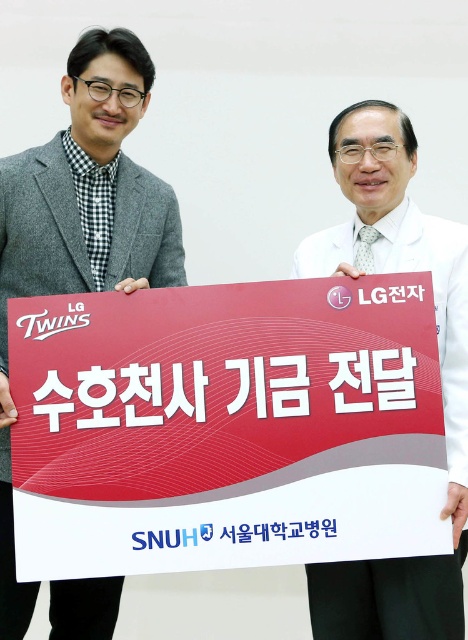
Who is higher up, matte gray blazer at left or white lab coat at center?

Positioned higher is matte gray blazer at left.

Who is more distant from viewer, (x=81, y=134) or (x=446, y=618)?

Point (x=81, y=134)

Where is `matte gray blazer at left`? The width and height of the screenshot is (468, 640). matte gray blazer at left is located at coordinates (80, 230).

Is red paper sign at center below matte gray blazer at left?

Yes, red paper sign at center is below matte gray blazer at left.

Can you confirm if red paper sign at center is smaller than matte gray blazer at left?

Correct, red paper sign at center occupies less space than matte gray blazer at left.

Locate an element on the screen. The height and width of the screenshot is (640, 468). red paper sign at center is located at coordinates (226, 428).

Where is `red paper sign at center`? red paper sign at center is located at coordinates (226, 428).

Which is above, red paper sign at center or white lab coat at center?

white lab coat at center is higher up.

Which of these two, red paper sign at center or white lab coat at center, stands shorter?

red paper sign at center

At what (x,y) coordinates should I click in order to perform the action: click on red paper sign at center. Please return your answer as a coordinate pair (x, y). The image size is (468, 640). Looking at the image, I should click on (226, 428).

I want to click on red paper sign at center, so click(x=226, y=428).